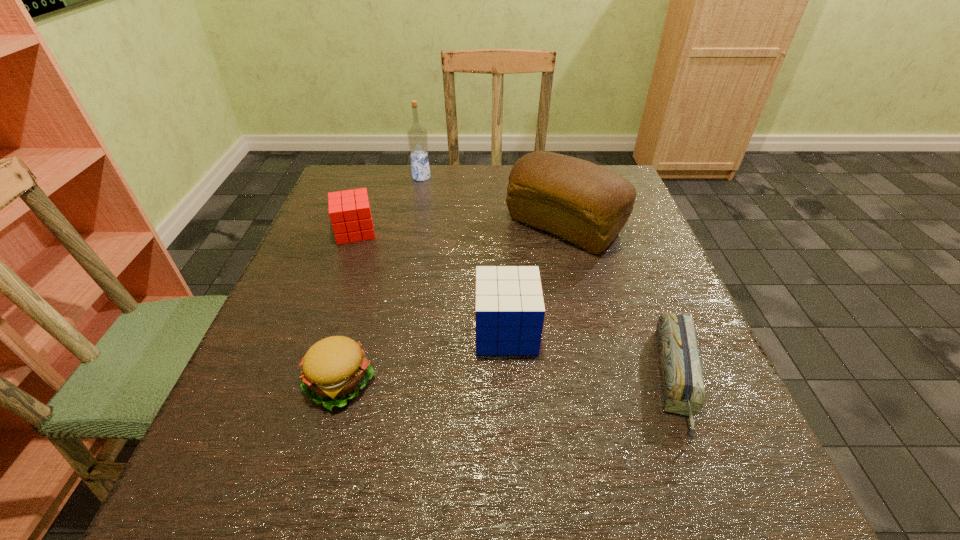
You are a GUI agent. You are given a task and a screenshot of the screen. Output one action in this format:
    pyautogui.click(x=<x>, y=<y>)
    Task: Click on the fifth closest object to the bread
    The image size is (960, 540).
    Given the screenshot: What is the action you would take?
    pyautogui.click(x=334, y=369)

Find the location of a particular element. vacant space that satisfies the following two spatial constraints: 1. on the front side of the pencil box; 2. on the right side of the fourth shortest object is located at coordinates (509, 379).

You are a GUI agent. You are given a task and a screenshot of the screen. Output one action in this format:
    pyautogui.click(x=<x>, y=<y>)
    Task: Click on the free spot that satisfies the following two spatial constraints: 1. on the back side of the hamburger; 2. on the left side of the pencil box
    The height and width of the screenshot is (540, 960).
    Given the screenshot: What is the action you would take?
    [x=342, y=379]

I want to click on vacant space that satisfies the following two spatial constraints: 1. on the front side of the fourth shortest object; 2. on the left side of the farther cube, so click(x=320, y=332).